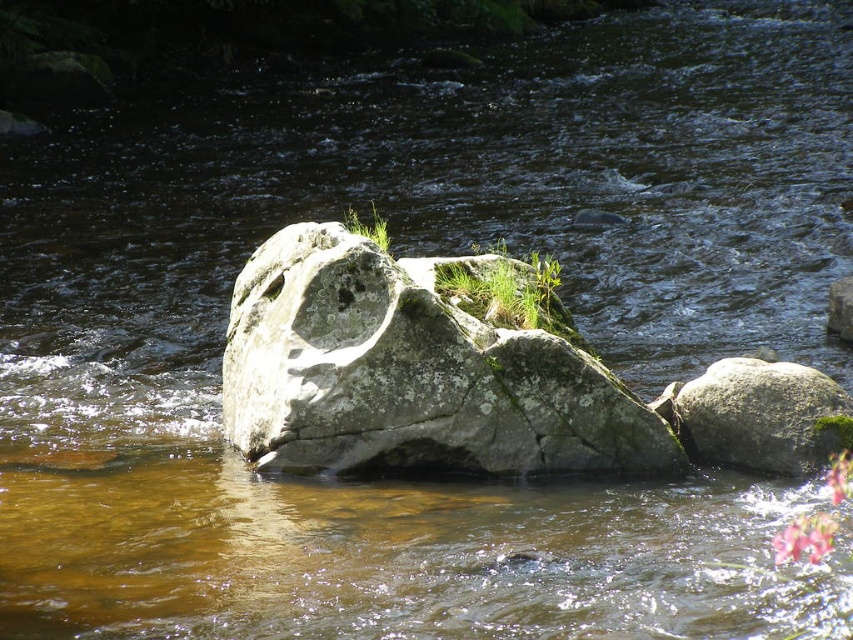
Question: Does gray rough rock at center have a larger size compared to gray rough rock at right?

Choices:
 (A) yes
 (B) no

Answer: (A)

Question: Which point appears closest to the camera in this image?

Choices:
 (A) (730, 358)
 (B) (323, 296)

Answer: (B)

Question: Considering the relative positions of gray rough rock at center and gray rough rock at right in the image provided, where is gray rough rock at center located with respect to gray rough rock at right?

Choices:
 (A) left
 (B) right

Answer: (A)

Question: Can you confirm if gray rough rock at center is wider than gray rough rock at right?

Choices:
 (A) no
 (B) yes

Answer: (B)

Question: Which point appears farthest from the camera in this image?

Choices:
 (A) (479, 358)
 (B) (788, 476)

Answer: (B)

Question: Which object is farther from the camera taking this photo?

Choices:
 (A) gray rough rock at right
 (B) gray rough rock at center

Answer: (A)